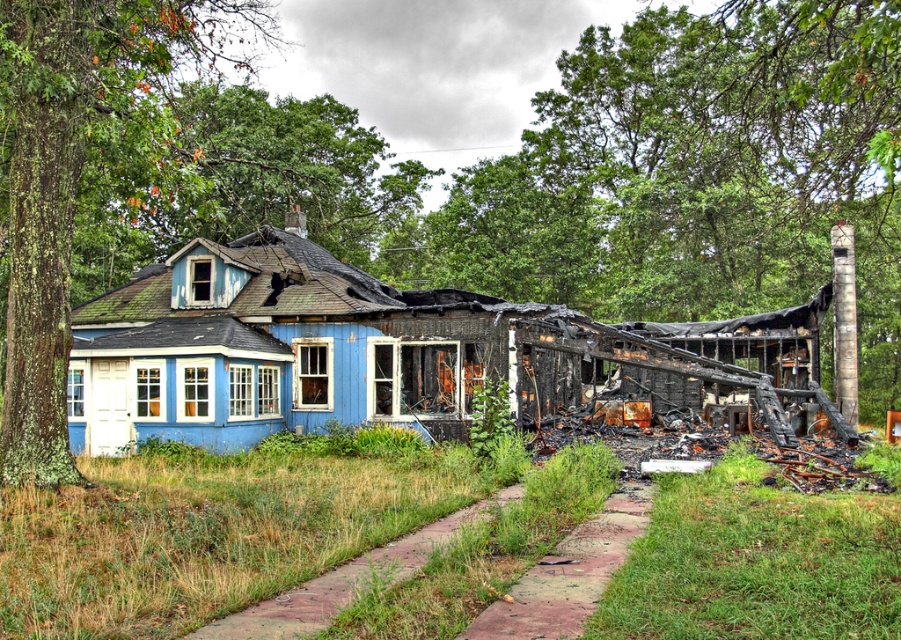
Who is positioned more to the left, green lichen-covered tree at left or green leafy tree at upper center?

green lichen-covered tree at left

Is point (49, 282) positioned behind point (301, 100)?

No, (49, 282) is closer to viewer.

The image size is (901, 640). I want to click on green lichen-covered tree at left, so click(76, 172).